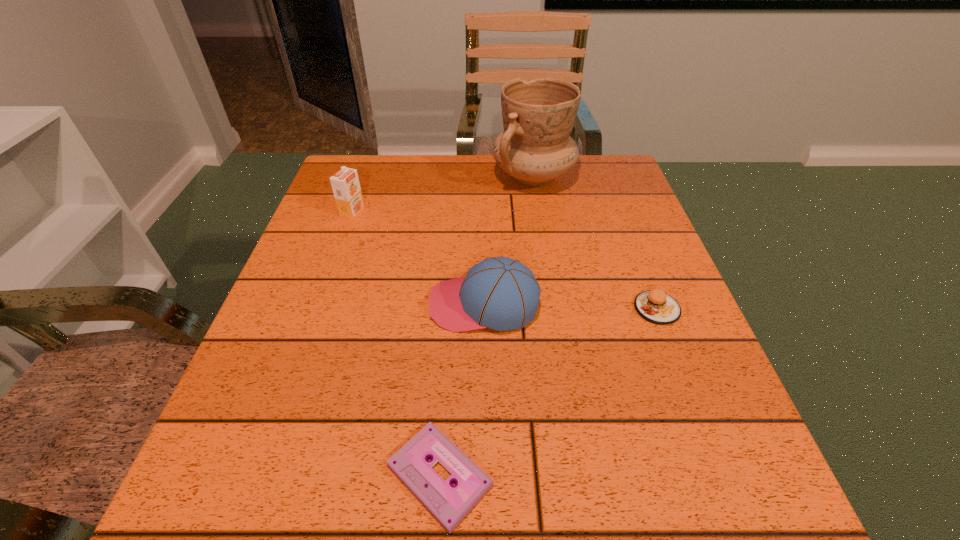
The width and height of the screenshot is (960, 540). I want to click on vacant area situated on the right of the second farthest object, so click(412, 213).

Where is `free space located 0.110m on the front-facing side of the baseball cap`? The height and width of the screenshot is (540, 960). free space located 0.110m on the front-facing side of the baseball cap is located at coordinates (373, 304).

The width and height of the screenshot is (960, 540). Identify the location of free location located 0.270m on the front-facing side of the baseball cap. pyautogui.click(x=292, y=304).

Locate an element on the screen. The height and width of the screenshot is (540, 960). free region located on the front-facing side of the baseball cap is located at coordinates (363, 304).

Identify the location of vacant area situated 0.180m on the back of the rightmost object. (629, 236).

Find the location of a particular element. vacant space located 0.060m on the left of the nearest object is located at coordinates (344, 475).

This screenshot has height=540, width=960. Identify the location of object at the far edge. (535, 147).

Find the location of a particular element. object situated at the near edge is located at coordinates (449, 504).

What are the coordinates of `object present at the left edge` in the screenshot? It's located at (345, 184).

Locate an element on the screen. pottery located in the right edge section of the desktop is located at coordinates (535, 147).